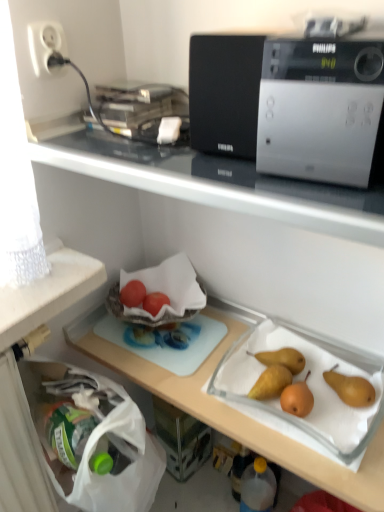
Question: Is silver metallic microwave at upper center in front of or behind white plastic socket at upper left in the image?

Choices:
 (A) front
 (B) behind

Answer: (A)

Question: Considering the positions of silver metallic microwave at upper center and white plastic socket at upper left in the image, is silver metallic microwave at upper center taller or shorter than white plastic socket at upper left?

Choices:
 (A) tall
 (B) short

Answer: (A)

Question: Which is nearer to the silver metallic microwave at upper center?

Choices:
 (A) matte red tomato at center-left, the 1th fruit positioned from the left
 (B) white plastic socket at upper left
 (C) transparent plastic bottle at lower center
 (D) matte red tomato at center, the first fruit when ordered from right to left

Answer: (B)

Question: Based on their relative distances, which object is nearer to the silver metallic microwave at upper center?

Choices:
 (A) matte red tomato at center, the first fruit when ordered from right to left
 (B) white plastic socket at upper left
 (C) transparent plastic bottle at lower center
 (D) matte red tomato at center-left, the 1th fruit positioned from the left

Answer: (B)